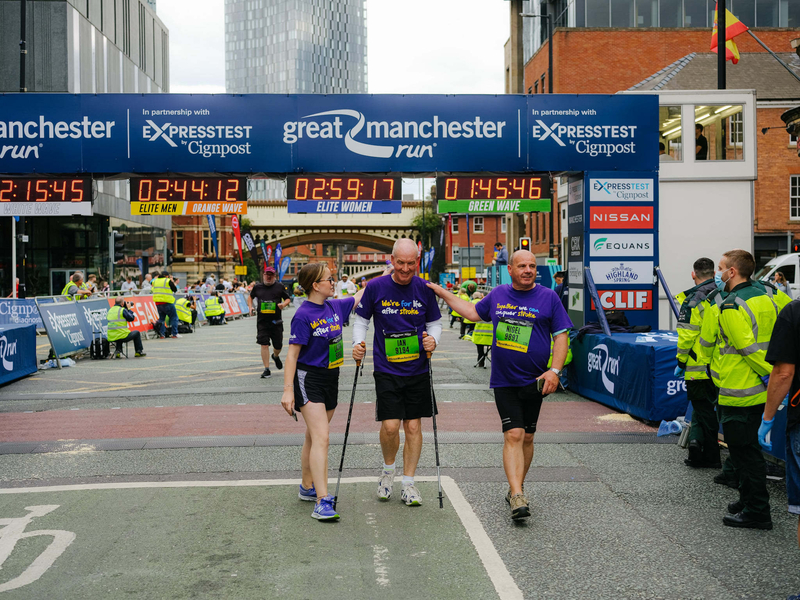
Image resolution: width=800 pixels, height=600 pixels. I want to click on dark blue table cloth, so click(x=653, y=352).